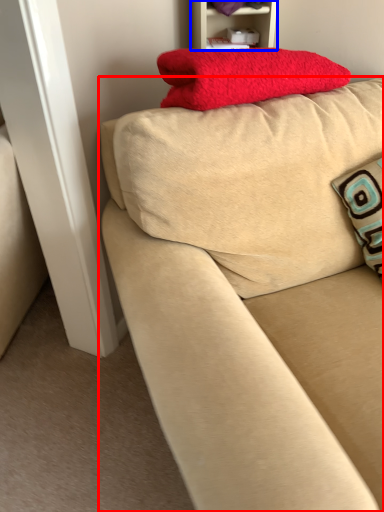
Question: Which object appears farthest to the camera in this image, studio couch (highlighted by a red box) or furniture (highlighted by a blue box)?

Choices:
 (A) studio couch
 (B) furniture

Answer: (B)